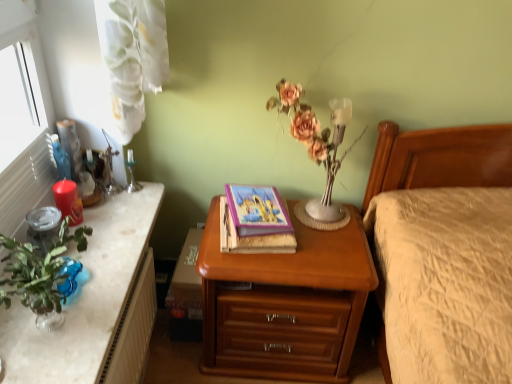
Where is `vacant area to the right of matte red candle at left`? vacant area to the right of matte red candle at left is located at coordinates (119, 224).